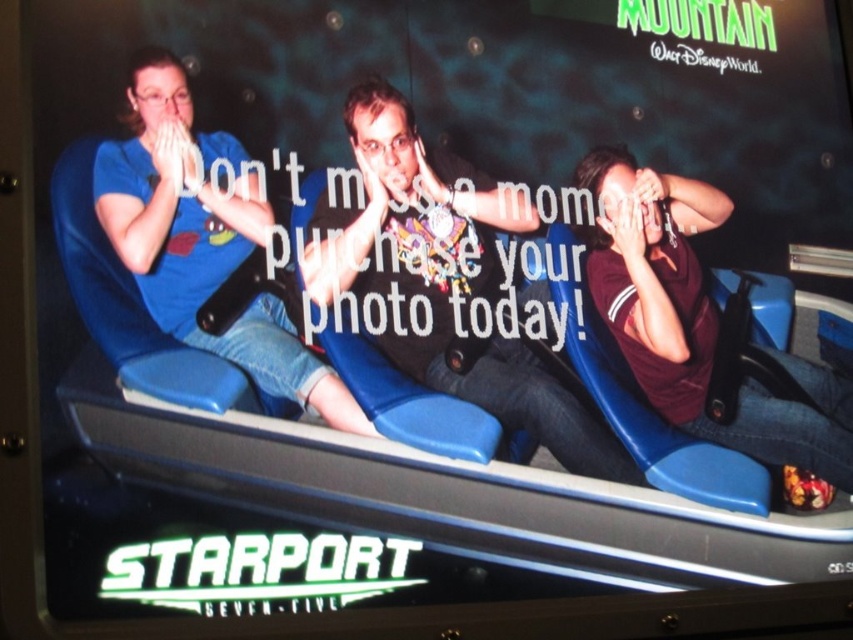
Based on the scene description, where exactly is the matte black shirt at center located in the image?

The matte black shirt at center is located at point coordinates of 0.444 on the x axis and 0.526 on the y axis.

You are standing in front of the Starport photo service ad and see the matte blue jeans at left and the maroon jersey at right. Which piece of clothing is located more to the left side of the ad?

The matte blue jeans at left is positioned on the left side of the maroon jersey at right, so the matte blue jeans at left is more to the left.